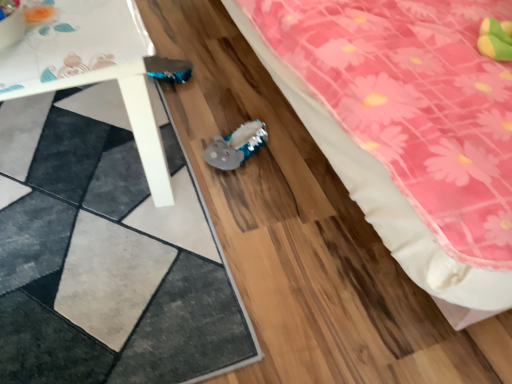
Identify the location of blank area beneath white plastic table at lower left (from a real-world perspective). (67, 148).